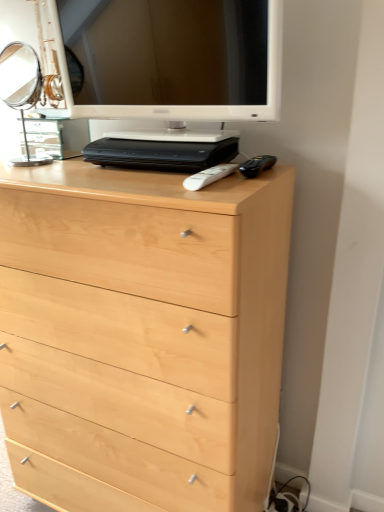
This screenshot has height=512, width=384. I want to click on free space in front of white plastic remote at center, so click(x=222, y=187).